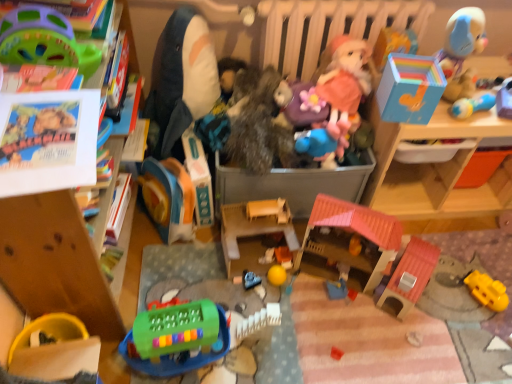
Where is `free point behind yellow plastic blocks at lower right, the 2th toy from the right`? The width and height of the screenshot is (512, 384). free point behind yellow plastic blocks at lower right, the 2th toy from the right is located at coordinates (473, 261).